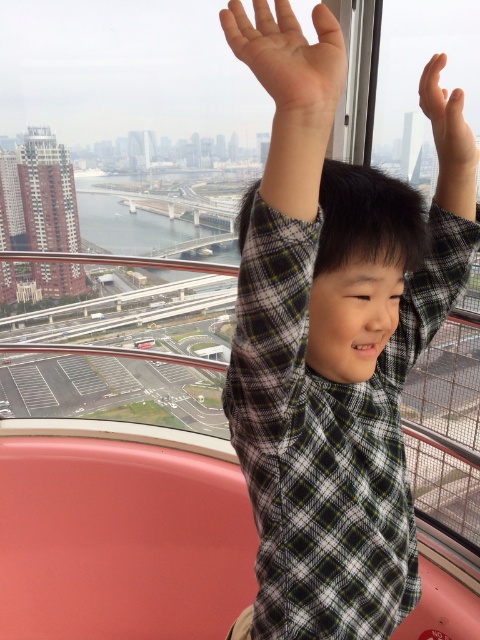
You are a photographer trying to capture the boy in the gondola. You notice the pale skin palm at upper center and the matte skin hand at upper right. Which hand should you focus on to ensure it appears closer in your photo?

The pale skin palm at upper center should be focused on because it is positioned in front of the matte skin hand at upper right, making it closer to the camera.

You are a photographer trying to capture a candid shot of the plaid shirt at center and the matte skin hand at upper right. Which object is closer to the camera lens?

The plaid shirt at center is shorter than the matte skin hand at upper right, so the plaid shirt at center is closer to the camera lens.